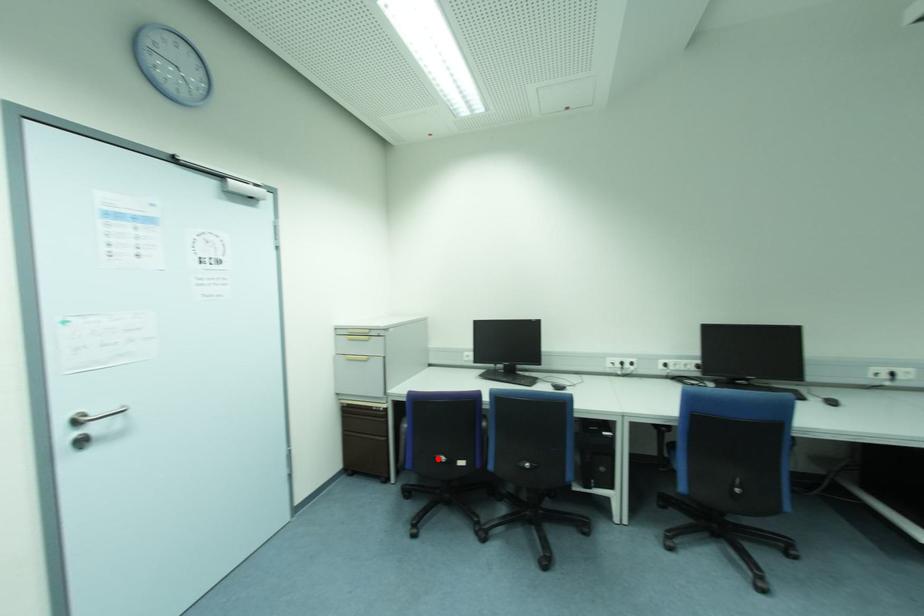
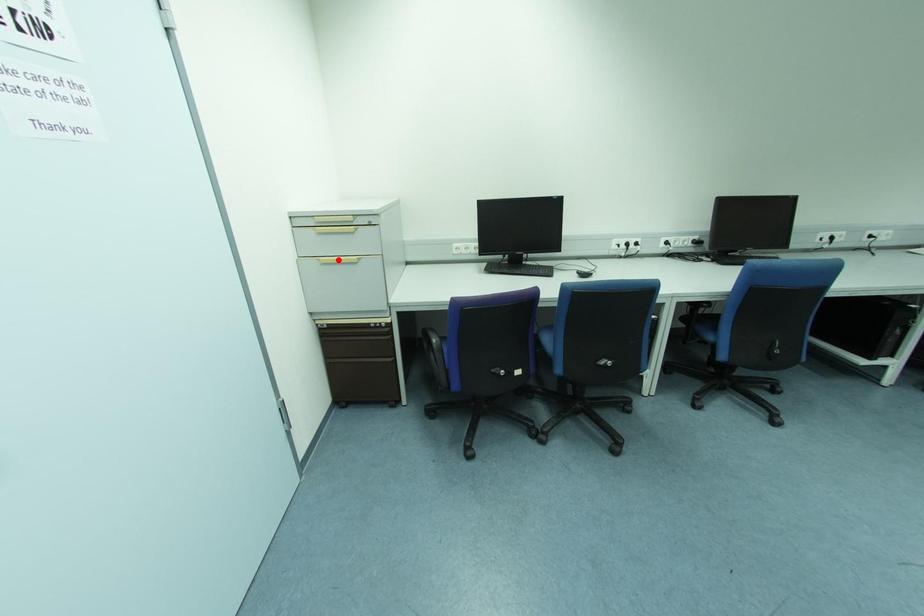
I am providing you with two images of the same scene from different viewpoints. A red point is marked on the first image and another point is marked on the second image. Do the highlighted points in image1 and image2 indicate the same real-world spot?

No